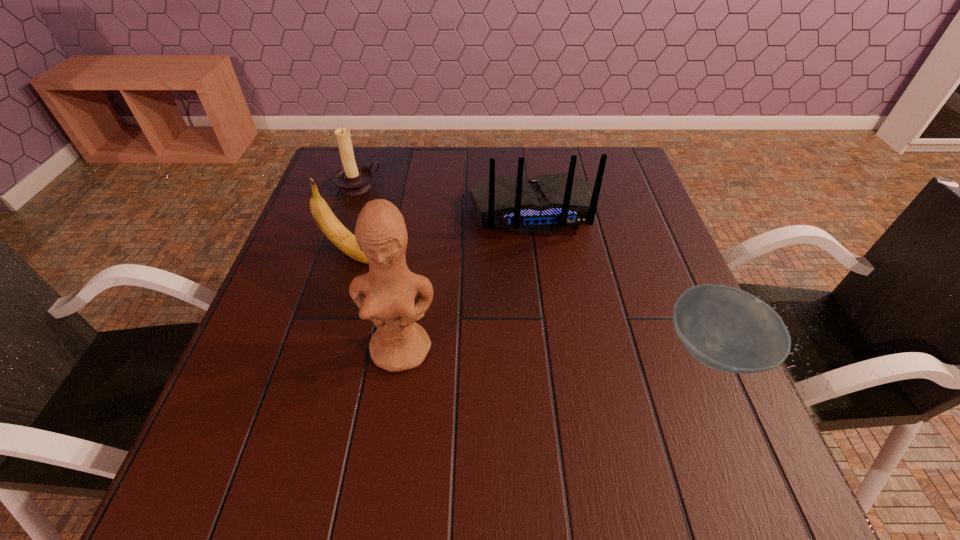
Find the location of `banana at the left edge`. banana at the left edge is located at coordinates (335, 231).

You are a GUI agent. You are given a task and a screenshot of the screen. Output one action in this format:
    pyautogui.click(x=<x>, y=<y>)
    Task: Click on the candle holder at the left edge
    The width and height of the screenshot is (960, 540).
    Given the screenshot: What is the action you would take?
    pyautogui.click(x=352, y=179)

This screenshot has width=960, height=540. I want to click on bowl at the right edge, so click(x=725, y=328).

Locate an element on the screen. This screenshot has width=960, height=540. router present at the right edge is located at coordinates (548, 203).

Find the location of `object at the far left corner`. object at the far left corner is located at coordinates (352, 179).

Locate an element on the screen. This screenshot has height=540, width=960. object present at the far right corner is located at coordinates (548, 203).

Where is `object that is at the near right corner`? The width and height of the screenshot is (960, 540). object that is at the near right corner is located at coordinates (725, 328).

Locate an element on the screen. The height and width of the screenshot is (540, 960). vacant space at the far edge of the desktop is located at coordinates (429, 149).

This screenshot has height=540, width=960. Identify the location of free space at the near edge. [x=589, y=397].

Locate an element on the screen. The width and height of the screenshot is (960, 540). free region at the left edge of the desktop is located at coordinates (272, 343).